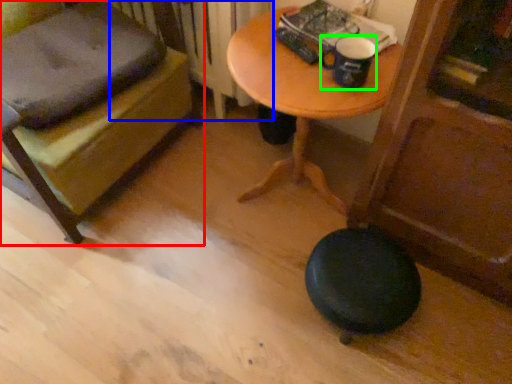
Question: Considering the real-world distances, which object is closest to furniture (highlighted by a red box)? radiator (highlighted by a blue box) or mug (highlighted by a green box).

Choices:
 (A) radiator
 (B) mug

Answer: (A)